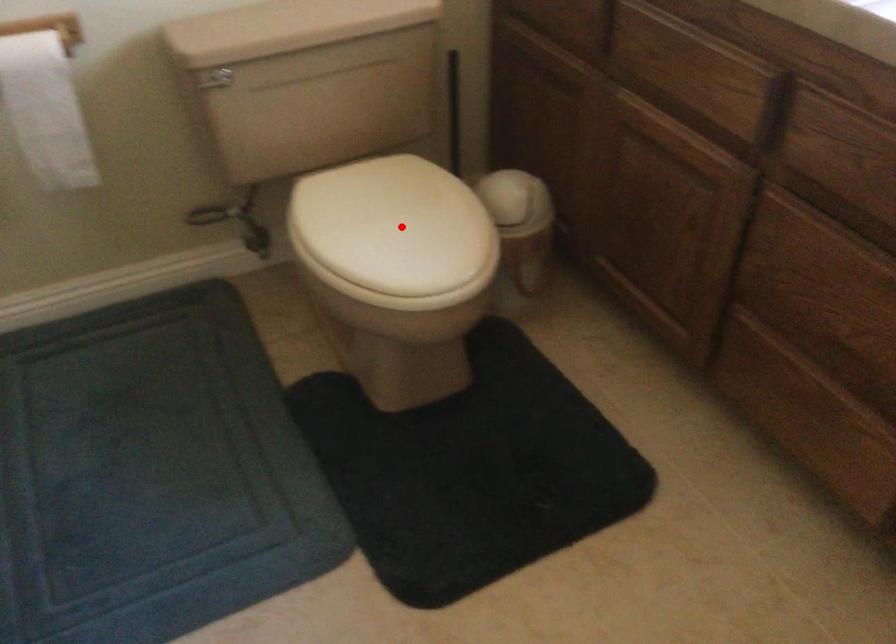
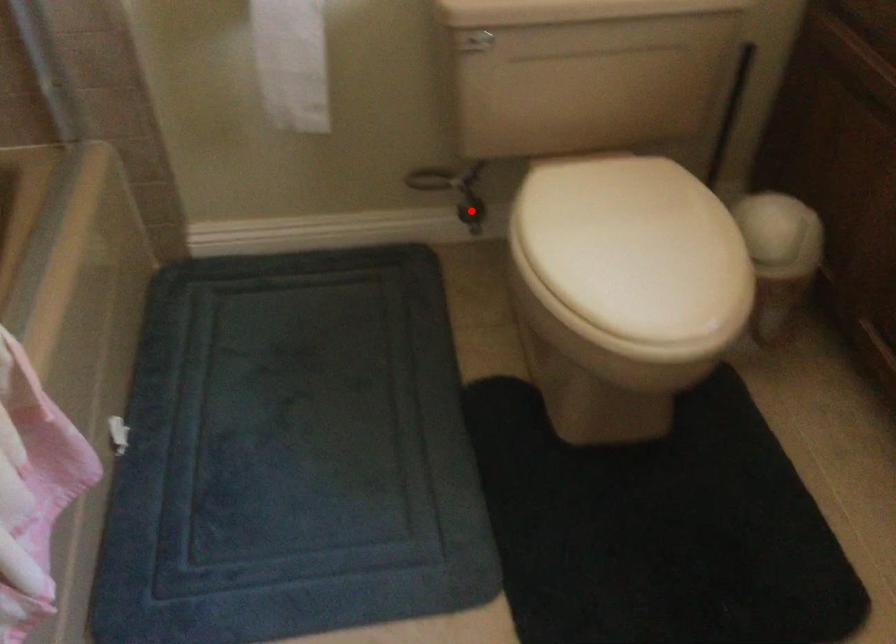
I am providing you with two images of the same scene from different viewpoints. A red point is marked on the first image and another point is marked on the second image. Are the points marked in image1 and image2 representing the same 3D position?

No